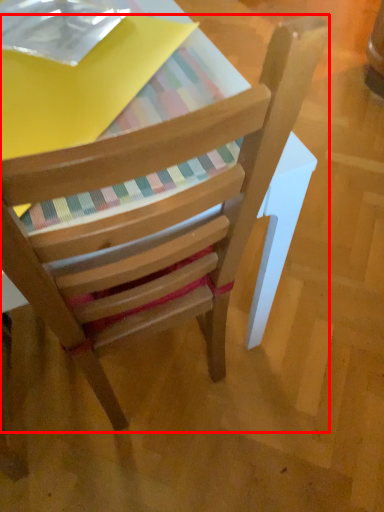
Question: Observing the image, what is the correct spatial positioning of chair (annotated by the red box) in reference to paperback book?

Choices:
 (A) left
 (B) right

Answer: (B)